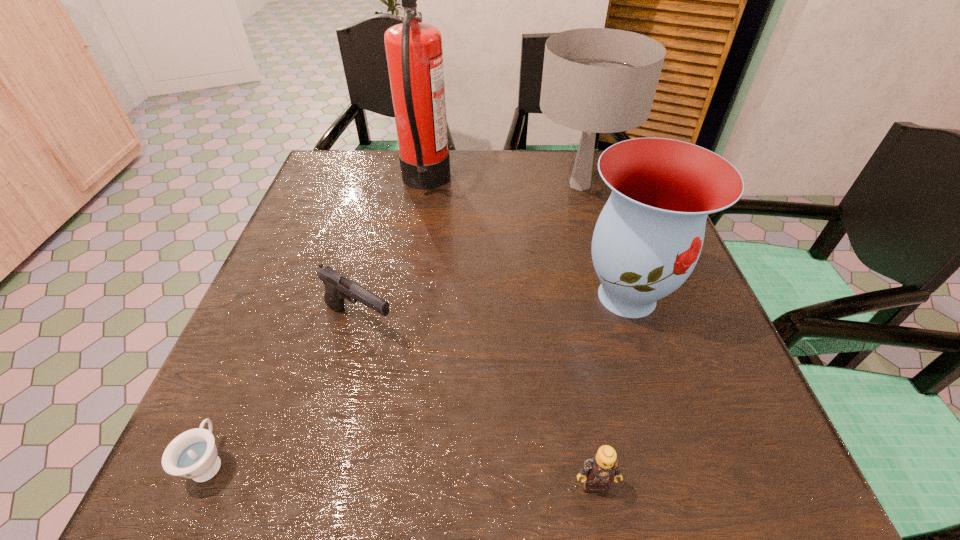
The image size is (960, 540). In order to click on free point located at the muzzle of the gun in this screenshot , I will do `click(602, 322)`.

Locate an element on the screen. This screenshot has width=960, height=540. vacant point located on the side of the leftmost object with the handle is located at coordinates tap(298, 257).

What are the coordinates of `vacant space located on the side of the leftmost object with the handle` in the screenshot? It's located at (246, 377).

Identify the location of vacant area located 0.370m on the side of the leftmost object with the handle. (294, 267).

Locate an element on the screen. The height and width of the screenshot is (540, 960). fire extinguisher that is at the far edge is located at coordinates (414, 52).

This screenshot has width=960, height=540. Identify the location of lampshade located in the far edge section of the desktop. (596, 80).

Where is `Lego present at the near edge`? The width and height of the screenshot is (960, 540). Lego present at the near edge is located at coordinates (600, 469).

You are a GUI agent. You are given a task and a screenshot of the screen. Output one action in this format:
    pyautogui.click(x=<x>, y=<y>)
    Task: Click on the teacup situated at the near edge
    The image size is (960, 540).
    Given the screenshot: What is the action you would take?
    pyautogui.click(x=193, y=454)

At what (x,y) coordinates should I click in order to perform the action: click on gun at the left edge. Please return your answer as a coordinate pair (x, y). Looking at the image, I should click on (337, 286).

Find the location of a particular element. The height and width of the screenshot is (540, 960). teacup situated at the left edge is located at coordinates pyautogui.click(x=193, y=454).